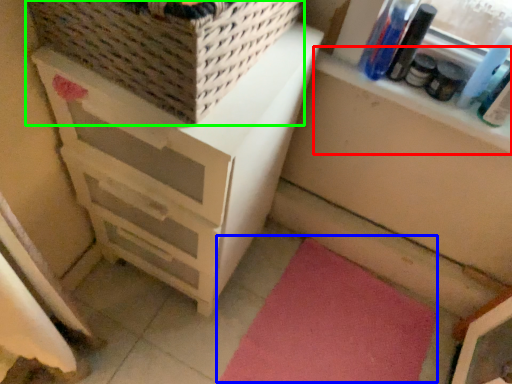
Question: Which object is positioned farthest from window sill (highlighted by a red box)? Select from yoga mat (highlighted by a blue box) and basket (highlighted by a green box).

Choices:
 (A) yoga mat
 (B) basket

Answer: (A)